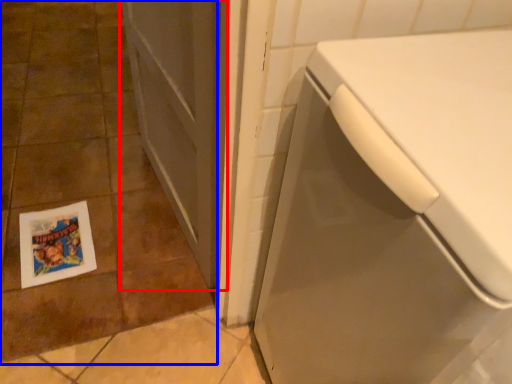
Question: Among these objects, which one is farthest to the camera, screen door (highlighted by a red box) or ceramic tile (highlighted by a blue box)?

Choices:
 (A) screen door
 (B) ceramic tile

Answer: (B)